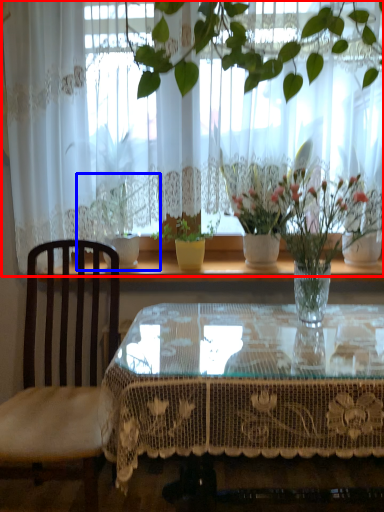
Question: Among these objects, which one is farthest to the camera, curtain (highlighted by a red box) or houseplant (highlighted by a blue box)?

Choices:
 (A) curtain
 (B) houseplant

Answer: (B)